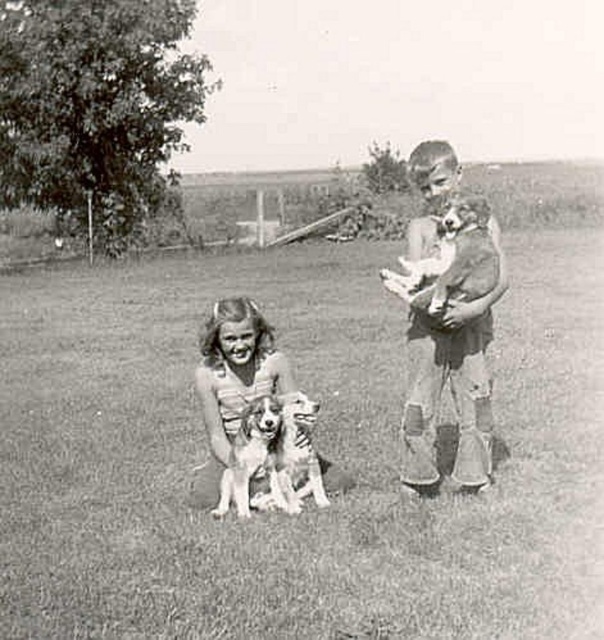
You are a photographer trying to capture both dogs in the scene. Since the soft fur dog at center and the soft fur dog at lower center are at different heights, which dog should you focus on first to ensure both are in frame?

The soft fur dog at center is shorter than the soft fur dog at lower center. To ensure both are in frame, focus on the taller dog first, which is the soft fur dog at lower center, then adjust the camera angle to include the shorter dog.

Consider the image. In the scene described, there are two dogs present. The smooth fur dog at lower center and the soft fur dog at center. Which dog is positioned to the left of the other?

The smooth fur dog at lower center is positioned to the left of the soft fur dog at center.